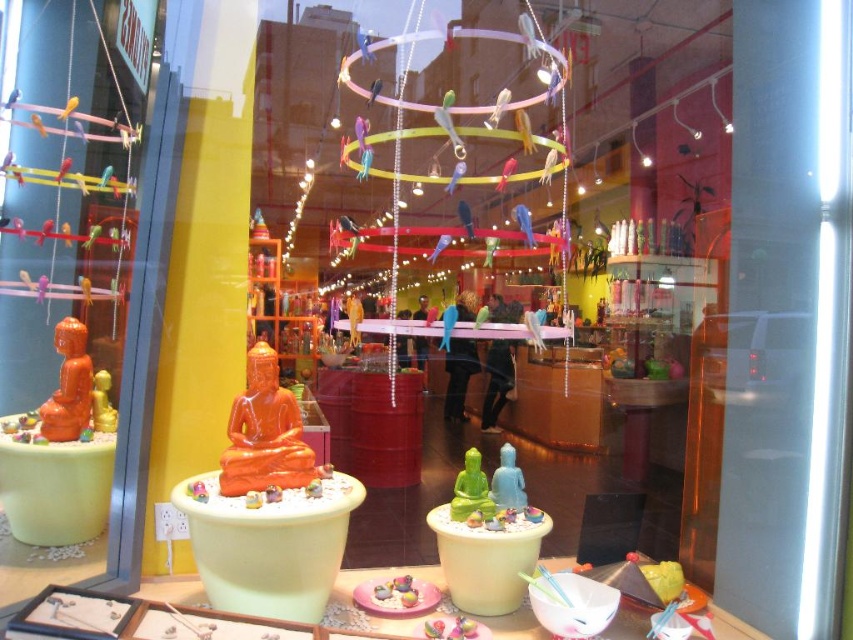
Does orange matte buddha at left have a greater width compared to gold matte buddha statue at center?

Indeed, orange matte buddha at left has a greater width compared to gold matte buddha statue at center.

The width and height of the screenshot is (853, 640). I want to click on orange matte buddha at left, so click(68, 385).

Locate an element on the screen. This screenshot has width=853, height=640. orange matte buddha at left is located at coordinates (68, 385).

Who is positioned more to the right, green matte buddha at center or matte blue buddha at center?

Positioned to the right is matte blue buddha at center.

Does green matte buddha at center have a lesser width compared to matte blue buddha at center?

In fact, green matte buddha at center might be wider than matte blue buddha at center.

The height and width of the screenshot is (640, 853). I want to click on green matte buddha at center, so click(471, 490).

Where is `orange matte buddha at left`? orange matte buddha at left is located at coordinates (68, 385).

Looking at this image, is orange matte buddha at left above green matte buddha at center?

Yes.

Which is behind, point (68, 369) or point (480, 486)?

The point (68, 369) is behind.

Identify the location of orange matte buddha at left. Image resolution: width=853 pixels, height=640 pixels. (68, 385).